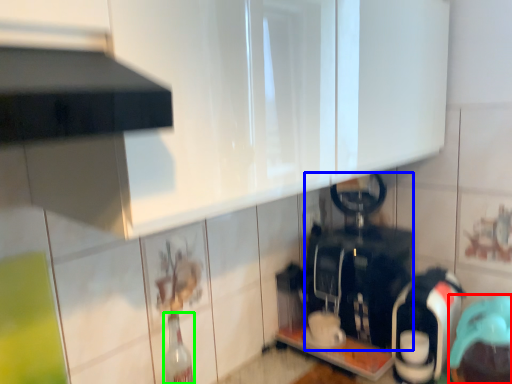
Question: Estimate the real-world distances between objects in this image. Which object is closer to appliance (highlighted by a red box), appliance (highlighted by a blue box) or bottle (highlighted by a green box)?

Choices:
 (A) appliance
 (B) bottle

Answer: (A)